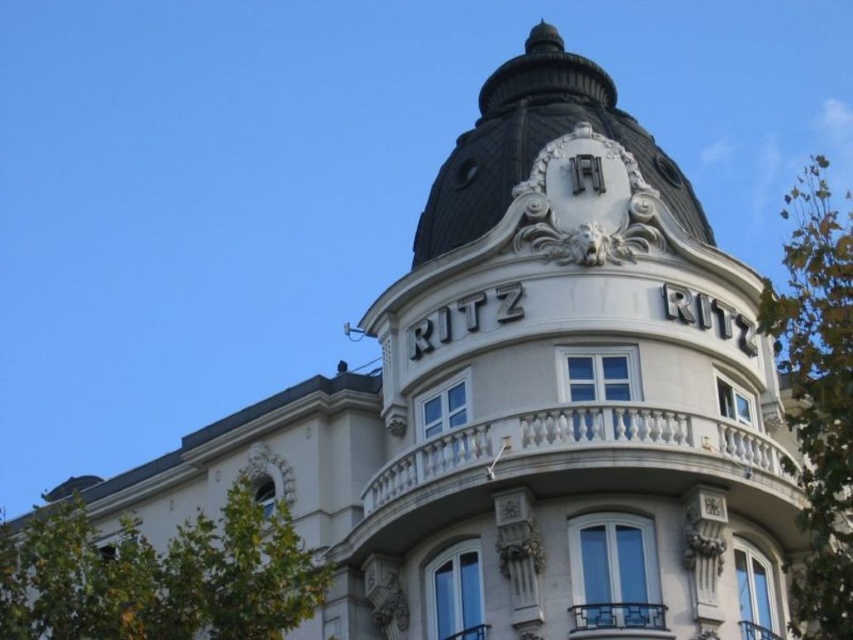
Which is above, green leafy tree at lower left or green leafy tree at right?

green leafy tree at right

Is green leafy tree at lower left positioned behind green leafy tree at right?

Yes, it is behind green leafy tree at right.

Who is more distant from viewer, (177,612) or (766,285)?

The point (766,285) is more distant.

The image size is (853, 640). Find the location of `green leafy tree at lower left`. green leafy tree at lower left is located at coordinates (158, 577).